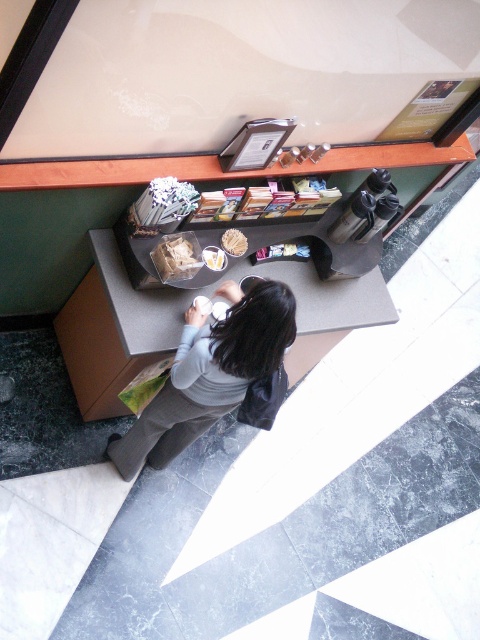
Question: Does dark gray sweater at center lie in front of white matte paper at center?

Choices:
 (A) yes
 (B) no

Answer: (A)

Question: Which of the following is the closest to the observer?

Choices:
 (A) (228, 234)
 (B) (224, 259)

Answer: (B)

Question: Which is nearer to the dark gray sweater at center?

Choices:
 (A) white matte paper at center
 (B) white paper napkin at center

Answer: (A)

Question: Is dark gray sweater at center closer to the viewer compared to white matte paper at center?

Choices:
 (A) no
 (B) yes

Answer: (B)

Question: Does dark gray sweater at center have a smaller size compared to white matte paper at center?

Choices:
 (A) no
 (B) yes

Answer: (A)

Question: Which of the following is the closest to the observer?

Choices:
 (A) (110, 435)
 (B) (216, 257)
 (C) (235, 250)

Answer: (B)